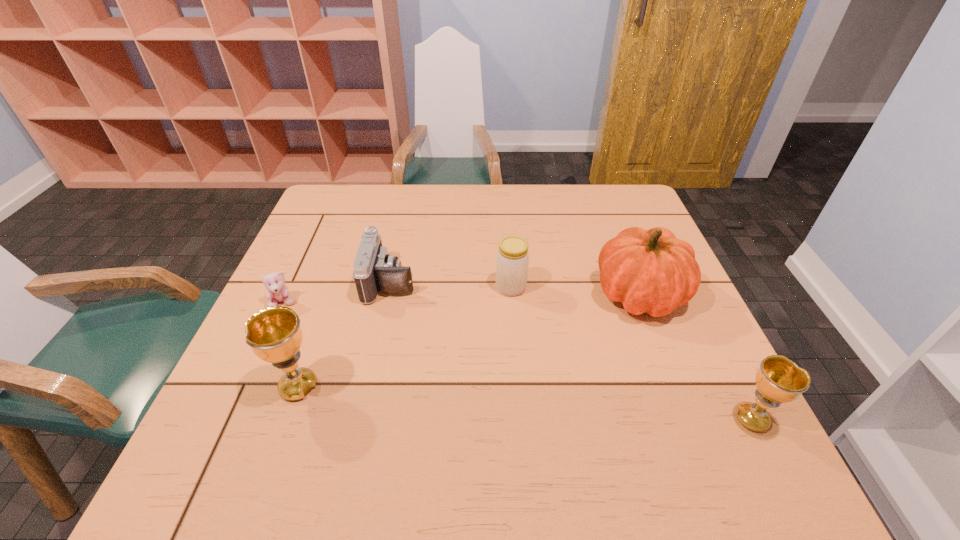
Where is `object that is at the near right corner`? This screenshot has width=960, height=540. object that is at the near right corner is located at coordinates (779, 380).

Find the location of `free space at the far edge`. free space at the far edge is located at coordinates coord(486,221).

Identify the location of vacant position at the near edge of the desktop. (580, 400).

Image resolution: width=960 pixels, height=540 pixels. Find the location of `free space at the left edge of the desktop`. free space at the left edge of the desktop is located at coordinates (306, 289).

You are a GUI agent. You are given a task and a screenshot of the screen. Output one action in this format:
    pyautogui.click(x=<x>, y=<y>)
    Task: Click on the vacant area at the far left corner
    
    Given the screenshot: What is the action you would take?
    pyautogui.click(x=336, y=208)

Where is `vacant area at the near left corner of the desktop`? The width and height of the screenshot is (960, 540). vacant area at the near left corner of the desktop is located at coordinates (256, 419).

At what (x,y) coordinates should I click in order to perform the action: click on free spot at the far right corner of the desktop. Please return your answer as a coordinate pair (x, y). This screenshot has width=960, height=540. Looking at the image, I should click on (622, 194).

Where is `free spot between the pumpkin and the taller chalice`? The image size is (960, 540). free spot between the pumpkin and the taller chalice is located at coordinates [x=469, y=341].

Where is `unoccupied area between the shorter chalice and the leftmost object`? unoccupied area between the shorter chalice and the leftmost object is located at coordinates (517, 361).

Where is `vacant region between the second object from left to right and the right chalice`? This screenshot has height=540, width=960. vacant region between the second object from left to right and the right chalice is located at coordinates (525, 403).